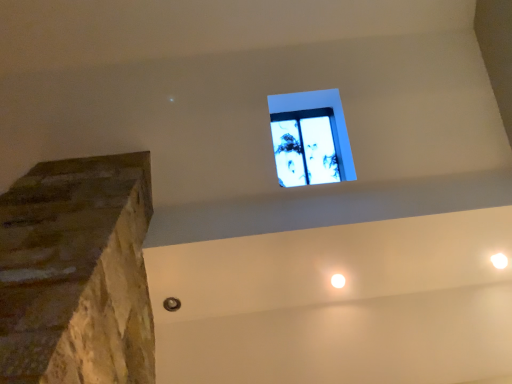
What do you see at coordinates (499, 260) in the screenshot? I see `white glossy light at upper right` at bounding box center [499, 260].

At what (x,y) coordinates should I click in order to perform the action: click on white glossy light at upper right. Please return your answer as a coordinate pair (x, y). This screenshot has height=384, width=512. Looking at the image, I should click on pyautogui.click(x=499, y=260).

Where is `white glossy light at upper right`? white glossy light at upper right is located at coordinates (499, 260).